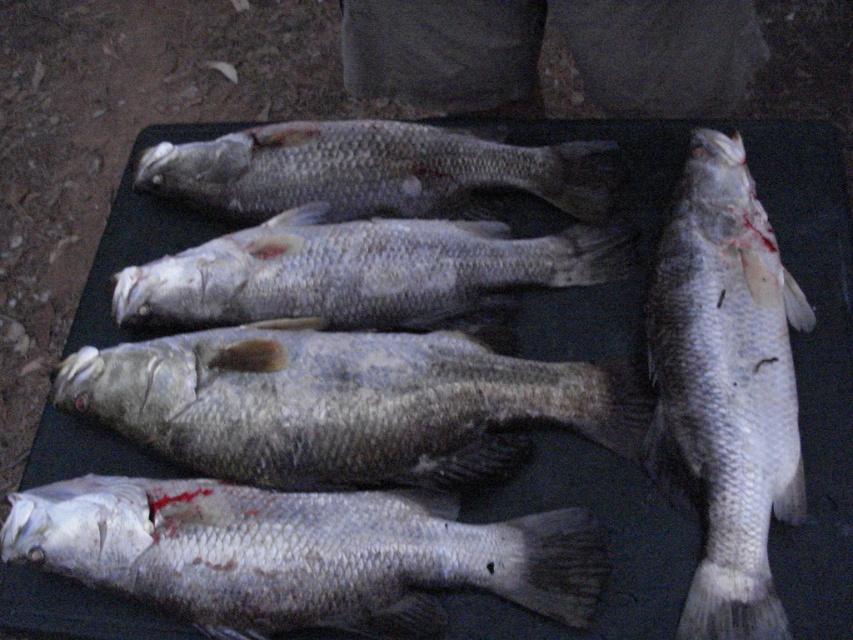
Question: Can you confirm if silver textured fish at center is thinner than silver/glossy fish at center?

Choices:
 (A) yes
 (B) no

Answer: (A)

Question: Based on their relative distances, which object is nearer to the silvery metallic fish at center?

Choices:
 (A) silver textured fish at center
 (B) grayish silver fish at center
 (C) silver/glossy fish at center
 (D) slick silver fish at bottom

Answer: (C)

Question: Based on their relative distances, which object is farther from the slick silver fish at bottom?

Choices:
 (A) silvery metallic fish at center
 (B) silver/glossy fish at center
 (C) silver textured fish at center
 (D) grayish silver fish at center

Answer: (B)

Question: Among these objects, which one is nearest to the camera?

Choices:
 (A) slick silver fish at bottom
 (B) silvery metallic fish at center

Answer: (A)

Question: Does slick silver fish at bottom have a lesser width compared to silver textured fish at center?

Choices:
 (A) no
 (B) yes

Answer: (A)

Question: Is silver textured fish at center below silvery metallic fish at center?

Choices:
 (A) yes
 (B) no

Answer: (A)